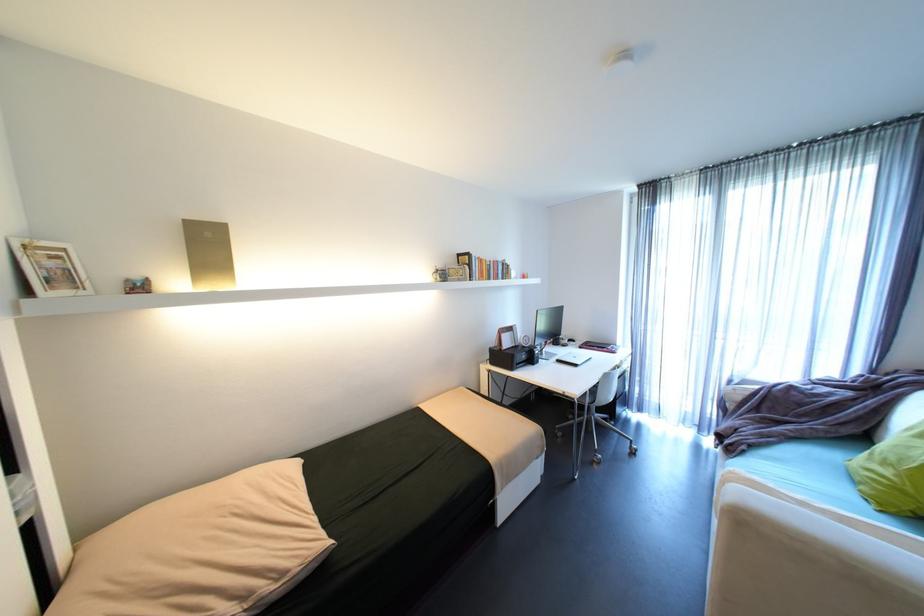
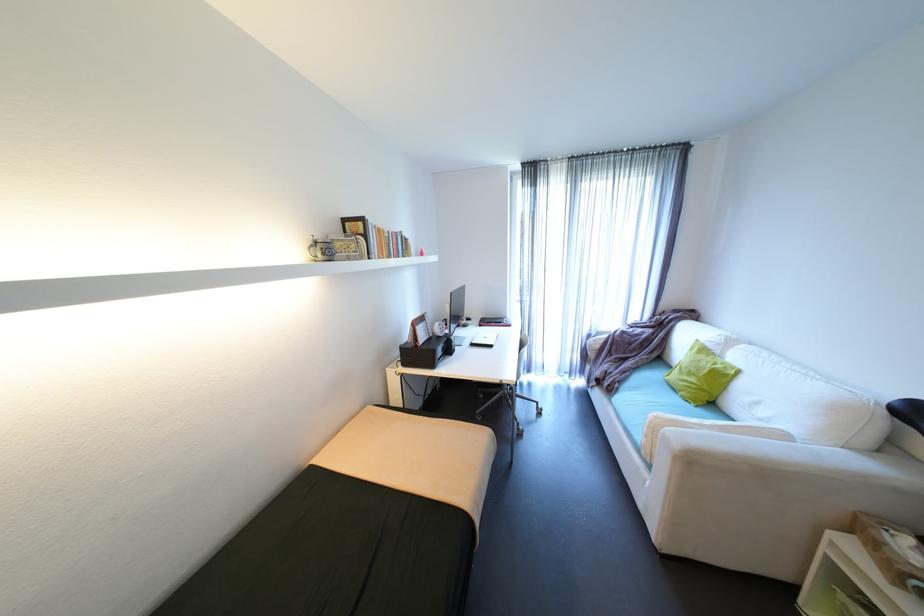
Where in the second image is the point corresponding to pixel 544 310 from the first image?

(458, 294)